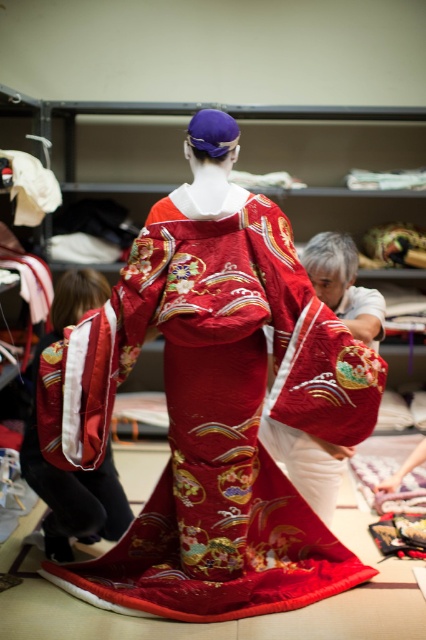
Question: Which point is closer to the camera?

Choices:
 (A) velvet red kimono at lower left
 (B) silky red kimono at center

Answer: (A)

Question: Does silky red kimono at center have a lesser width compared to velvet red kimono at lower left?

Choices:
 (A) no
 (B) yes

Answer: (B)

Question: Is silky red kimono at center to the left of velvet red kimono at lower left from the viewer's perspective?

Choices:
 (A) yes
 (B) no

Answer: (B)

Question: Among these objects, which one is nearest to the camera?

Choices:
 (A) silky red kimono at center
 (B) velvet red kimono at lower left

Answer: (B)

Question: Can you confirm if silky red kimono at center is smaller than velvet red kimono at lower left?

Choices:
 (A) no
 (B) yes

Answer: (B)